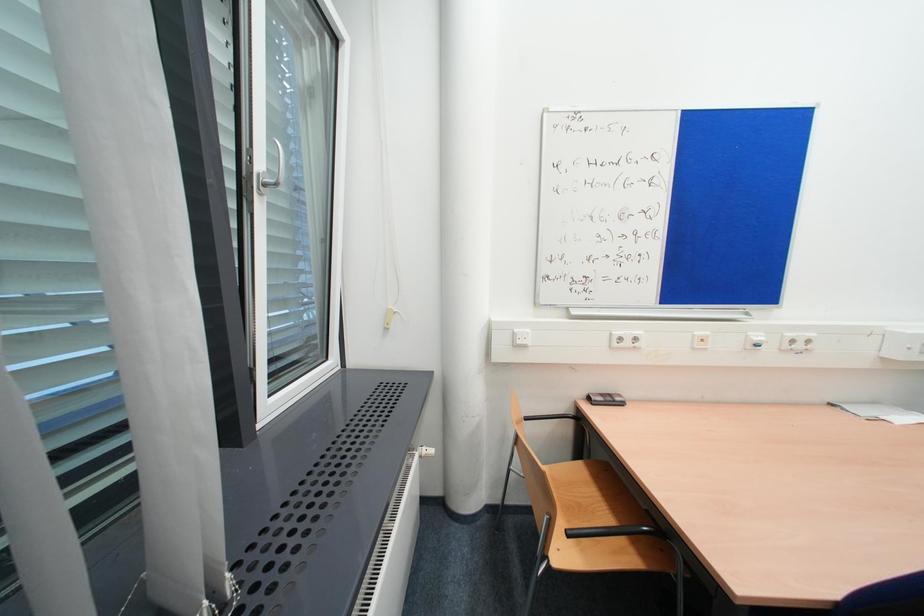
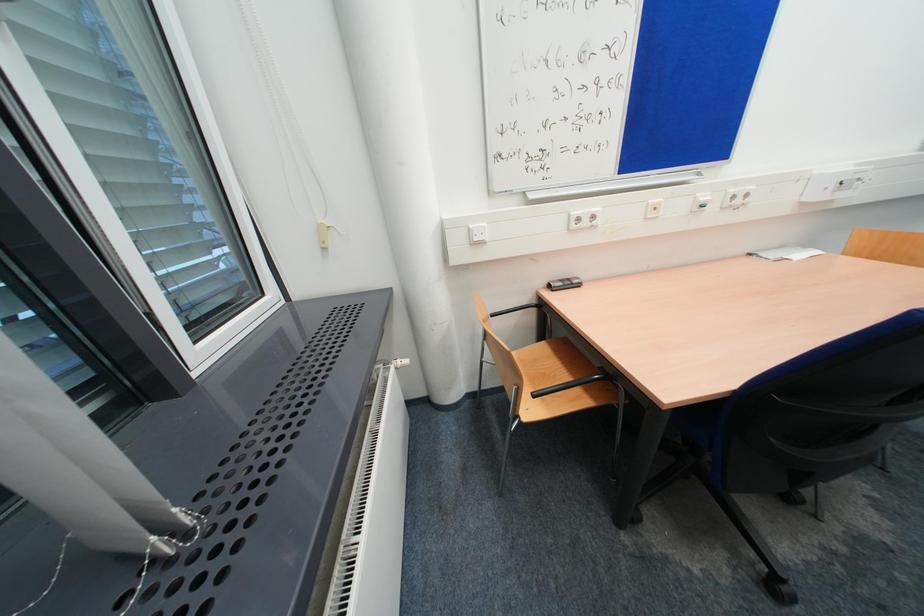
What movement of the cameraman would produce the second image?

The cameraman walked toward right, forward.